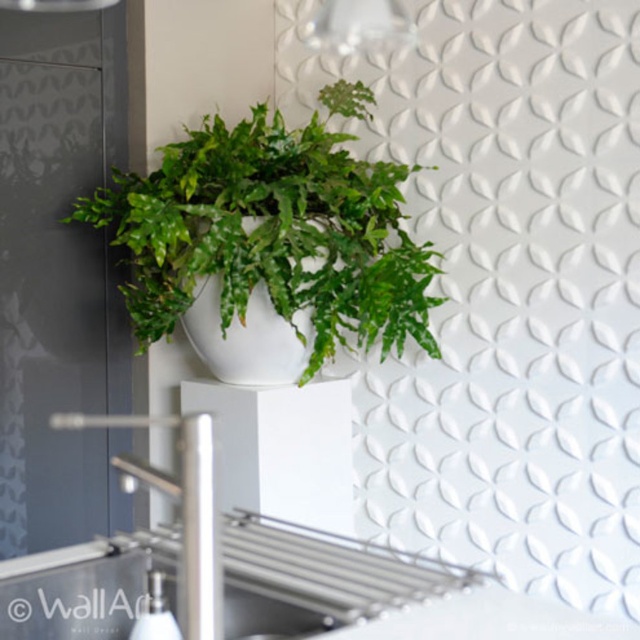
Question: Is green matte plant at upper center wider than silver metallic faucet at center?

Choices:
 (A) no
 (B) yes

Answer: (B)

Question: Is green matte plant at upper center below silver metallic faucet at center?

Choices:
 (A) yes
 (B) no

Answer: (B)

Question: Among these points, which one is nearest to the camera?

Choices:
 (A) (196, 541)
 (B) (346, 173)

Answer: (A)

Question: Does green matte plant at upper center lie behind silver metallic faucet at center?

Choices:
 (A) no
 (B) yes

Answer: (B)

Question: Which of the following is the closest to the observer?

Choices:
 (A) silver metallic faucet at center
 (B) green matte plant at upper center

Answer: (A)